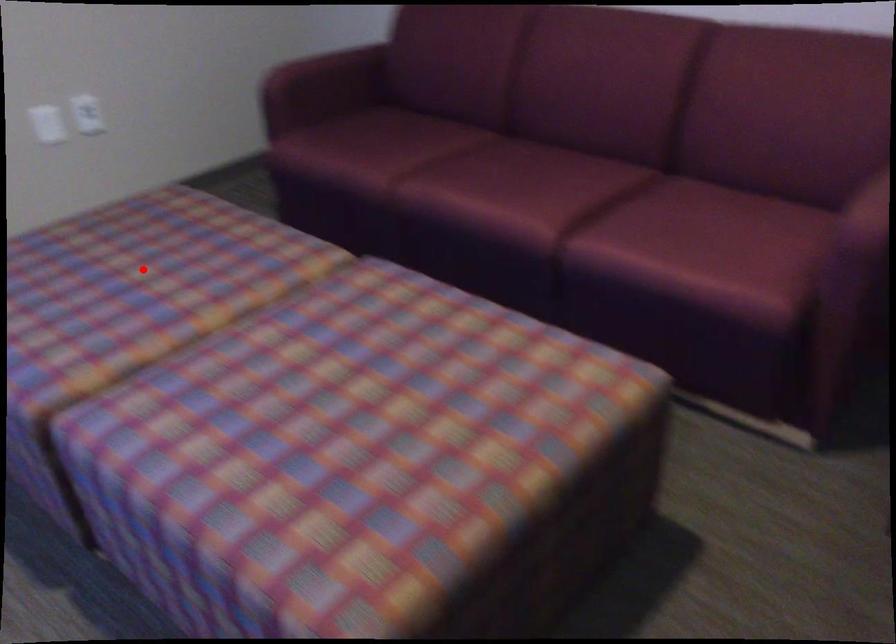
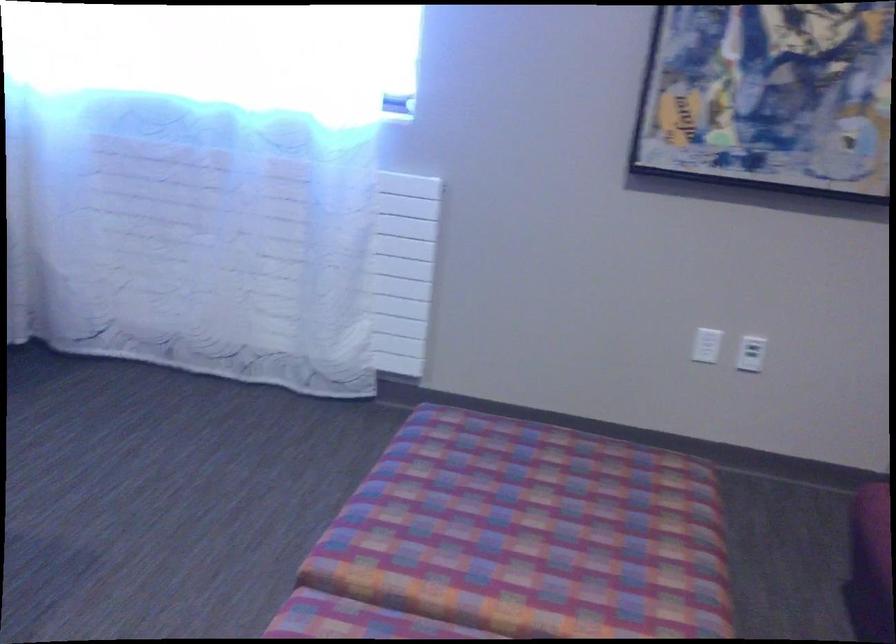
Find the pixel in the second image that matches the highlighted location in the first image.

(550, 516)